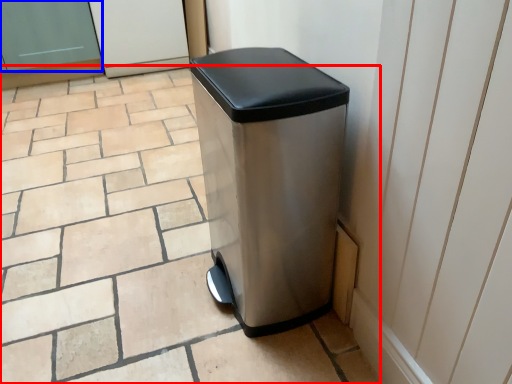
Question: Which point is closer to the camera, tile (highlighted by a red box) or screen door (highlighted by a blue box)?

Choices:
 (A) tile
 (B) screen door

Answer: (A)